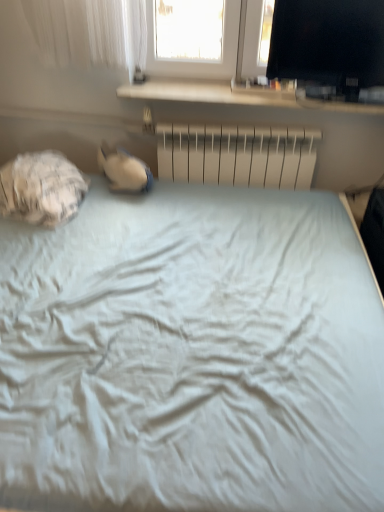
What is the approximate height of black glossy monitor at upper right?

It is 16.76 inches.

At what (x,y) coordinates should I click in order to perform the action: click on black glossy monitor at upper right. Please return your answer as a coordinate pair (x, y). Looking at the image, I should click on (329, 47).

From a real-world perspective, between black glossy monitor at upper right and white textured sleeping bag at left, who is vertically lower?

white textured sleeping bag at left.

Which of these two, black glossy monitor at upper right or white textured sleeping bag at left, is thinner?

black glossy monitor at upper right.

Does black glossy monitor at upper right lie in front of white textured sleeping bag at left?

No, it is not.

Is black glossy monitor at upper right oriented away from white textured sleeping bag at left?

black glossy monitor at upper right does not have its back to white textured sleeping bag at left.

Considering the positions of point (260, 148) and point (368, 42), is point (260, 148) closer or farther from the camera than point (368, 42)?

Point (260, 148) is positioned farther from the camera compared to point (368, 42).

Between metallic silver radiator at center and black glossy monitor at upper right, which one has smaller width?

With smaller width is metallic silver radiator at center.

Is metallic silver radiator at center positioned before black glossy monitor at upper right?

That is False.

Find the location of a particular element. radiator directly beneath the black glossy monitor at upper right (from a real-world perspective) is located at coordinates (238, 155).

Find the location of a particular element. This screenshot has width=384, height=512. computer monitor above the white textured sleeping bag at left (from the image's perspective) is located at coordinates (329, 47).

From a real-world perspective, who is located higher, white textured sleeping bag at left or black glossy monitor at upper right?

black glossy monitor at upper right, from a real-world perspective.

Relative to black glossy monitor at upper right, is white textured sleeping bag at left in front or behind?

Visually, white textured sleeping bag at left is located in front of black glossy monitor at upper right.

Considering the points (256, 154) and (10, 197), which point is in front, point (256, 154) or point (10, 197)?

The point (10, 197) is closer to the camera.

From the picture: Does metallic silver radiator at center have a greater width compared to white textured sleeping bag at left?

No, metallic silver radiator at center is not wider than white textured sleeping bag at left.

Can you confirm if metallic silver radiator at center is taller than white textured sleeping bag at left?

Yes.

From the image's perspective, who appears lower, metallic silver radiator at center or white textured sleeping bag at left?

white textured sleeping bag at left appears lower in the image.

Is white textured sleeping bag at left oriented towards metallic silver radiator at center?

Yes, white textured sleeping bag at left is turned towards metallic silver radiator at center.

Consider the image. From the image's perspective, would you say white textured sleeping bag at left is positioned over metallic silver radiator at center?

No.

Is white textured sleeping bag at left shorter than metallic silver radiator at center?

Correct, white textured sleeping bag at left is not as tall as metallic silver radiator at center.

Are black glossy monitor at upper right and metallic silver radiator at center beside each other?

No, black glossy monitor at upper right is not in contact with metallic silver radiator at center.

Does black glossy monitor at upper right have a greater width compared to metallic silver radiator at center?

Yes.

Which object is further away from the camera taking this photo, black glossy monitor at upper right or metallic silver radiator at center?

metallic silver radiator at center is further away from the camera.

From a real-world perspective, who is located lower, black glossy monitor at upper right or metallic silver radiator at center?

metallic silver radiator at center.

Where is `sleeping bag that is under the black glossy monitor at upper right (from a real-world perspective)`? The image size is (384, 512). sleeping bag that is under the black glossy monitor at upper right (from a real-world perspective) is located at coordinates (41, 188).

Identify the location of radiator on the left of black glossy monitor at upper right. (238, 155).

Looking at the image, which one is located closer to black glossy monitor at upper right, metallic silver radiator at center or white textured sleeping bag at left?

Among the two, metallic silver radiator at center is located nearer to black glossy monitor at upper right.

From the image, which object appears to be nearer to metallic silver radiator at center, black glossy monitor at upper right or white textured sleeping bag at left?

black glossy monitor at upper right.

When comparing their distances from white textured sleeping bag at left, does metallic silver radiator at center or black glossy monitor at upper right seem further?

black glossy monitor at upper right.

From the image, which object appears to be farther from metallic silver radiator at center, white textured sleeping bag at left or black glossy monitor at upper right?

white textured sleeping bag at left is further to metallic silver radiator at center.

Looking at the image, which one is located further to white textured sleeping bag at left, black glossy monitor at upper right or metallic silver radiator at center?

black glossy monitor at upper right is further to white textured sleeping bag at left.

From the image, which object appears to be nearer to black glossy monitor at upper right, white textured sleeping bag at left or metallic silver radiator at center?

Among the two, metallic silver radiator at center is located nearer to black glossy monitor at upper right.

This screenshot has height=512, width=384. In order to click on radiator between white textured sleeping bag at left and black glossy monitor at upper right in the horizontal direction in this screenshot , I will do `click(238, 155)`.